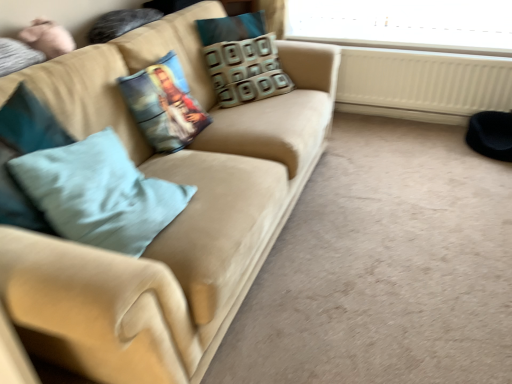
Question: Is suede beige couch at center far from white plastic radiator at lower right?

Choices:
 (A) no
 (B) yes

Answer: (B)

Question: From the image's perspective, is suede beige couch at center beneath white plastic radiator at lower right?

Choices:
 (A) yes
 (B) no

Answer: (A)

Question: Does suede beige couch at center have a lesser height compared to white plastic radiator at lower right?

Choices:
 (A) yes
 (B) no

Answer: (B)

Question: Can you see suede beige couch at center touching white plastic radiator at lower right?

Choices:
 (A) yes
 (B) no

Answer: (B)

Question: Could you tell me if suede beige couch at center is facing white plastic radiator at lower right?

Choices:
 (A) no
 (B) yes

Answer: (A)

Question: Is white plastic radiator at lower right at the back of suede beige couch at center?

Choices:
 (A) no
 (B) yes

Answer: (A)

Question: Considering the relative sizes of light blue fabric pillow at left and white plastic radiator at lower right in the image provided, is light blue fabric pillow at left taller than white plastic radiator at lower right?

Choices:
 (A) yes
 (B) no

Answer: (B)

Question: Is light blue fabric pillow at left oriented towards white plastic radiator at lower right?

Choices:
 (A) yes
 (B) no

Answer: (B)

Question: Does light blue fabric pillow at left have a lesser width compared to white plastic radiator at lower right?

Choices:
 (A) no
 (B) yes

Answer: (A)

Question: Is light blue fabric pillow at left wider than white plastic radiator at lower right?

Choices:
 (A) no
 (B) yes

Answer: (B)

Question: Would you say light blue fabric pillow at left is a long distance from white plastic radiator at lower right?

Choices:
 (A) no
 (B) yes

Answer: (B)

Question: From the image's perspective, would you say light blue fabric pillow at left is positioned over white plastic radiator at lower right?

Choices:
 (A) yes
 (B) no

Answer: (B)

Question: Is light blue fabric pillow at left not inside patterned fabric pillow at center, the 1th pillow from the right?

Choices:
 (A) no
 (B) yes

Answer: (B)